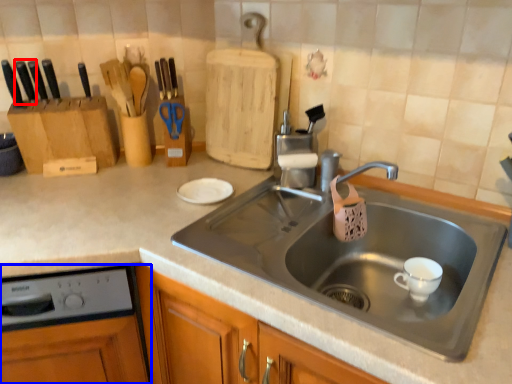
Question: Which point is closer to the camera, knife (highlighted by a red box) or dish washer (highlighted by a blue box)?

Choices:
 (A) knife
 (B) dish washer

Answer: (B)